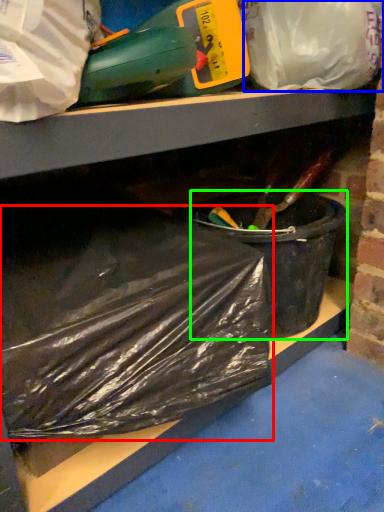
Question: Based on their relative distances, which object is farther from plastic bag (highlighted by a red box)? Choose from plastic bag (highlighted by a blue box) and recycling bin (highlighted by a green box).

Choices:
 (A) plastic bag
 (B) recycling bin

Answer: (A)